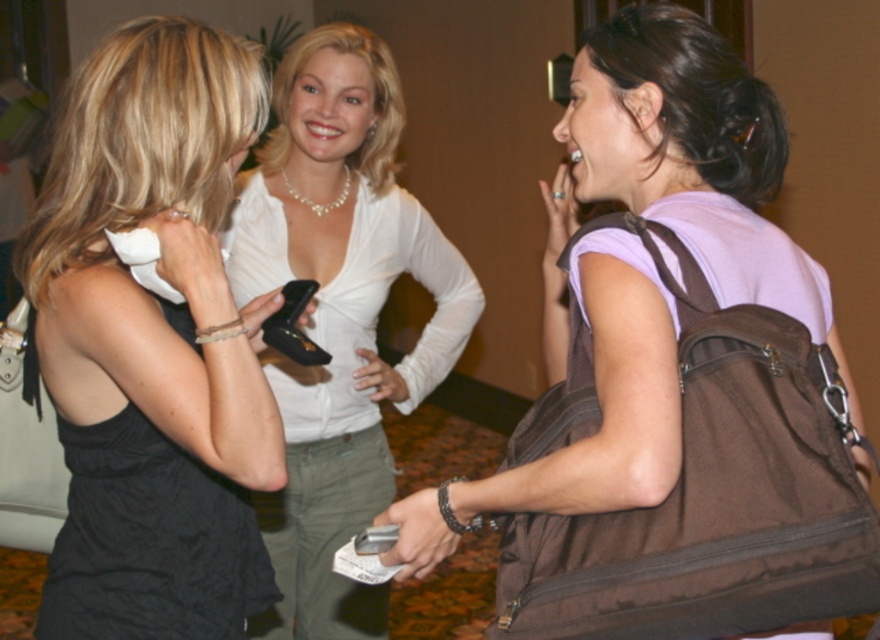
Question: Among these points, which one is nearest to the camera?

Choices:
 (A) (286, 324)
 (B) (644, 35)
 (C) (441, 294)
 (D) (199, 88)

Answer: (D)

Question: Can you confirm if black satin dress at left is wider than white satin blouse at center?

Choices:
 (A) yes
 (B) no

Answer: (B)

Question: Among these objects, which one is farthest from the camera?

Choices:
 (A) white satin blouse at center
 (B) black satin dress at left

Answer: (A)

Question: Among these objects, which one is farthest from the camera?

Choices:
 (A) black rubber smartphone at center
 (B) black satin dress at left

Answer: (A)

Question: Can you confirm if black satin dress at left is bigger than metallic silver phone at center?

Choices:
 (A) yes
 (B) no

Answer: (A)

Question: Observing the image, what is the correct spatial positioning of white satin blouse at center in reference to metallic silver phone at center?

Choices:
 (A) left
 (B) right

Answer: (A)